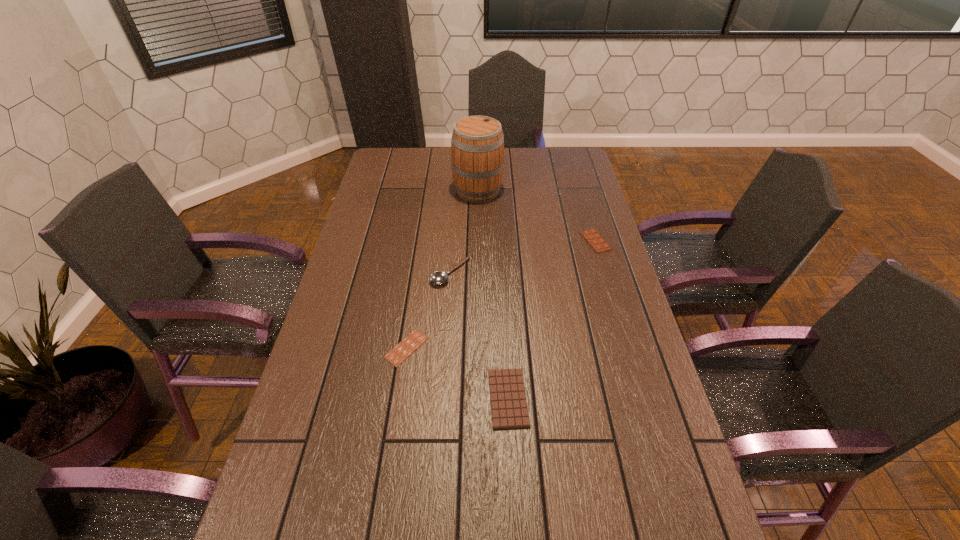
I want to click on the tallest object, so click(477, 145).

Identify the location of the farthest object. The image size is (960, 540). click(477, 145).

Where is `the fourth shortest object`? Image resolution: width=960 pixels, height=540 pixels. the fourth shortest object is located at coordinates 439,277.

You are a GUI agent. You are given a task and a screenshot of the screen. Output one action in this format:
    pyautogui.click(x=<x>, y=<y>)
    Task: Click on the ladle
    The image size is (960, 540).
    Given the screenshot: What is the action you would take?
    pyautogui.click(x=439, y=277)

Identify the location of the second farthest object. (593, 238).

The width and height of the screenshot is (960, 540). I want to click on the farthest chocolate bar, so click(x=593, y=238).

The height and width of the screenshot is (540, 960). I want to click on the nearest chocolate bar, so click(509, 408).

Find the location of a particular element. This screenshot has height=540, width=960. the nearest object is located at coordinates (509, 408).

Where is `the second nearest chocolate bar`? the second nearest chocolate bar is located at coordinates (396, 356).

What are the coordinates of `the second nearest object` in the screenshot? It's located at (396, 356).